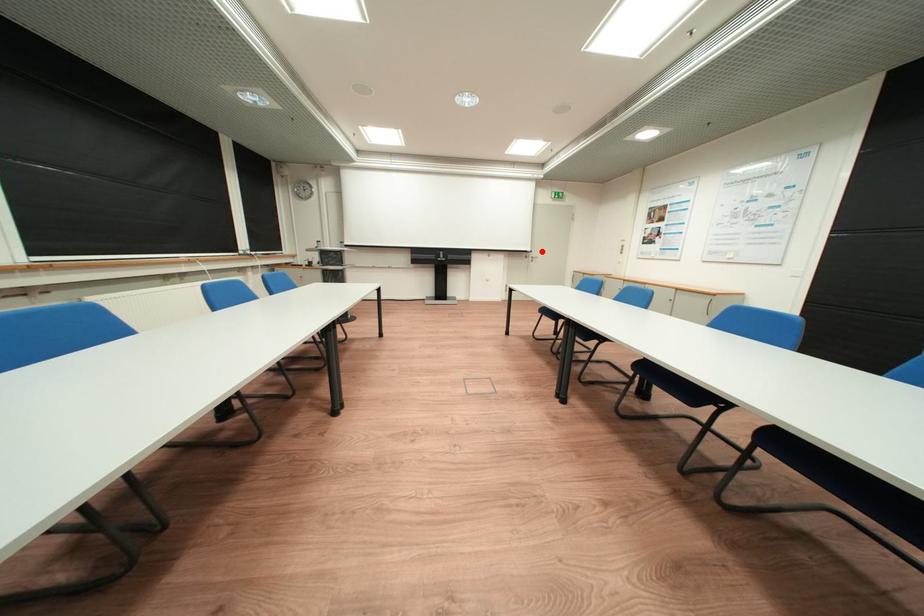
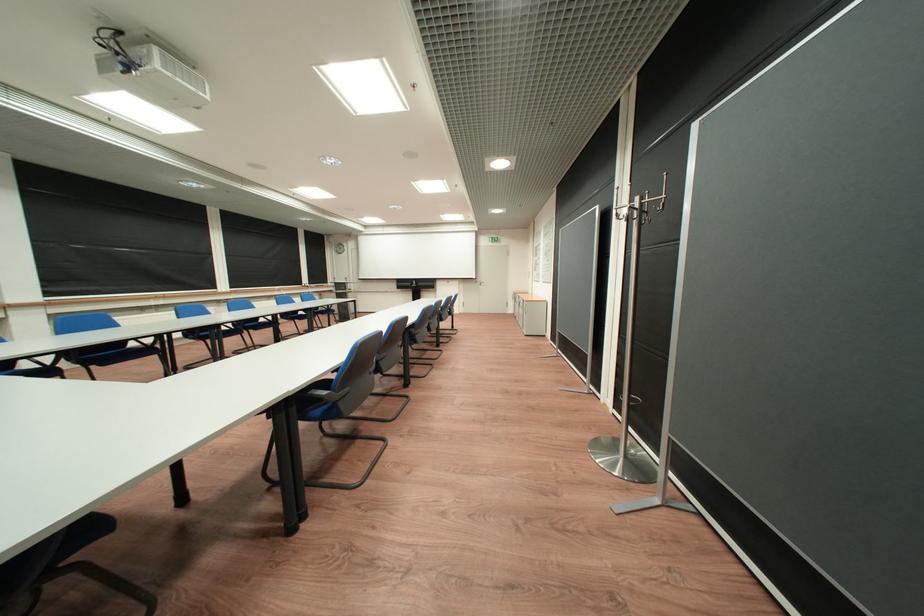
Find the pixel in the second image that matches the highlighted location in the first image.

(487, 278)